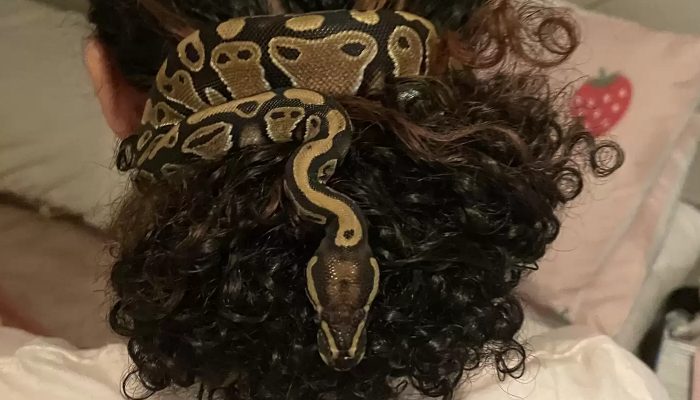
Where is `bed sheets`? The height and width of the screenshot is (400, 700). bed sheets is located at coordinates (50, 276).